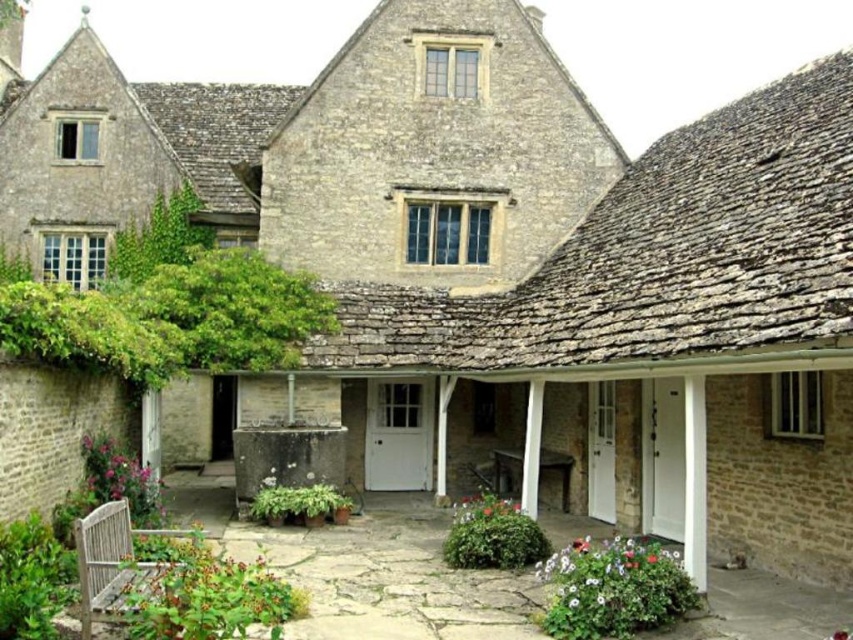
You are standing in the courtyard in front of the traditional stone house. You see a fluffy green bush at lower right and a green leafy bush at lower left. Which bush is closer to the ground?

The fluffy green bush at lower right is closer to the ground because it is below the green leafy bush at lower left.

You are standing in the courtyard in front of the traditional stone house. You notice a fluffy green bush at lower right and a green leafy plant at lower left. Which one has a larger width?

The fluffy green bush at lower right might be wider than the green leafy plant at lower left.

You are standing in the courtyard in front of the traditional stone house. You see a green leafy plant at lower left and a green leafy bush at center. Which one is positioned more to the left side of the courtyard?

The green leafy plant at lower left is positioned more to the left side of the courtyard because it is to the left of the green leafy bush at center.